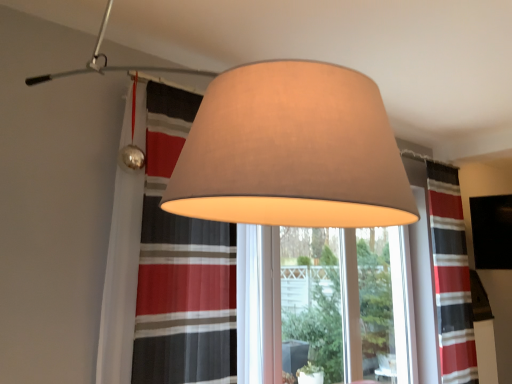
Question: From their relative heights in the image, would you say clear glass window frame at center is taller or shorter than matte beige lampshade at upper center?

Choices:
 (A) tall
 (B) short

Answer: (B)

Question: From a real-world perspective, is clear glass window frame at center above or below matte beige lampshade at upper center?

Choices:
 (A) below
 (B) above

Answer: (A)

Question: Which of these objects is positioned closest to the clear glass window frame at center?

Choices:
 (A) matte beige lampshade at upper center, acting as the first lamp starting from the back
 (B) striped fabric curtain at right
 (C) matte gray lampshade at center, placed as the second lamp when sorted from back to front
 (D) matte beige lampshade at upper center

Answer: (D)

Question: Which object is the farthest from the matte beige lampshade at upper center, the second lamp positioned from the front?

Choices:
 (A) clear glass window frame at center
 (B) matte gray lampshade at center, the first lamp when ordered from front to back
 (C) striped fabric curtain at right
 (D) matte beige lampshade at upper center

Answer: (C)